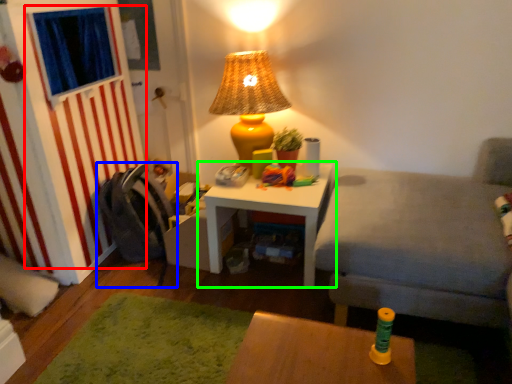
Question: Estimate the real-world distances between objects in this image. Which object is closer to curtain (highlighted by a red box), swivel chair (highlighted by a blue box) or table (highlighted by a green box)?

Choices:
 (A) swivel chair
 (B) table

Answer: (A)